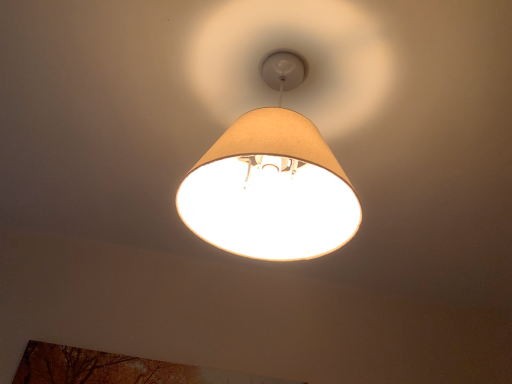
Question: Is autumn leaves painting at lower left aimed at beige fabric lampshade at center?

Choices:
 (A) yes
 (B) no

Answer: (B)

Question: Considering the relative sizes of autumn leaves painting at lower left and beige fabric lampshade at center in the image provided, is autumn leaves painting at lower left wider than beige fabric lampshade at center?

Choices:
 (A) no
 (B) yes

Answer: (A)

Question: Can you confirm if autumn leaves painting at lower left is positioned to the left of beige fabric lampshade at center?

Choices:
 (A) yes
 (B) no

Answer: (A)

Question: Would you say autumn leaves painting at lower left is a long distance from beige fabric lampshade at center?

Choices:
 (A) no
 (B) yes

Answer: (B)

Question: From a real-world perspective, is autumn leaves painting at lower left on top of beige fabric lampshade at center?

Choices:
 (A) no
 (B) yes

Answer: (A)

Question: Considering the relative sizes of autumn leaves painting at lower left and beige fabric lampshade at center in the image provided, is autumn leaves painting at lower left taller than beige fabric lampshade at center?

Choices:
 (A) no
 (B) yes

Answer: (A)

Question: From a real-world perspective, is beige fabric lampshade at center located higher than autumn leaves painting at lower left?

Choices:
 (A) yes
 (B) no

Answer: (A)

Question: Is beige fabric lampshade at center shorter than autumn leaves painting at lower left?

Choices:
 (A) no
 (B) yes

Answer: (A)

Question: Is beige fabric lampshade at center turned away from autumn leaves painting at lower left?

Choices:
 (A) no
 (B) yes

Answer: (B)

Question: Is beige fabric lampshade at center completely or partially outside of autumn leaves painting at lower left?

Choices:
 (A) no
 (B) yes

Answer: (B)

Question: Considering the relative positions of beige fabric lampshade at center and autumn leaves painting at lower left in the image provided, is beige fabric lampshade at center to the left of autumn leaves painting at lower left from the viewer's perspective?

Choices:
 (A) yes
 (B) no

Answer: (B)

Question: Is beige fabric lampshade at center aimed at autumn leaves painting at lower left?

Choices:
 (A) no
 (B) yes

Answer: (A)

Question: Do you think autumn leaves painting at lower left is within beige fabric lampshade at center, or outside of it?

Choices:
 (A) inside
 (B) outside

Answer: (B)